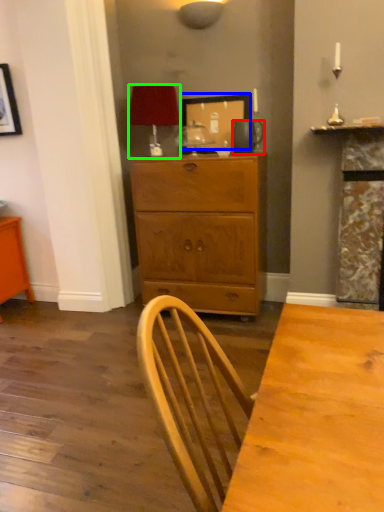
Question: Estimate the real-world distances between objects in this image. Which object is closer to pitcher (highlighted by a red box), picture frame (highlighted by a blue box) or lamp (highlighted by a green box)?

Choices:
 (A) picture frame
 (B) lamp

Answer: (A)